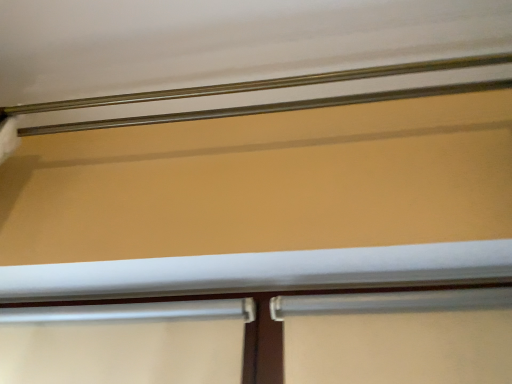
Consider the image. What is the approximate width of white glossy window at center?

white glossy window at center is 3.61 inches wide.

In order to face white glossy window at center, should I rotate leftwards or rightwards?

Turn left approximately 4.019 degrees to face it.

This screenshot has width=512, height=384. Identify the location of white glossy window at center. (276, 342).

This screenshot has width=512, height=384. What do you see at coordinates (276, 342) in the screenshot?
I see `white glossy window at center` at bounding box center [276, 342].

This screenshot has width=512, height=384. What are the coordinates of `white glossy window at center` in the screenshot? It's located at (276, 342).